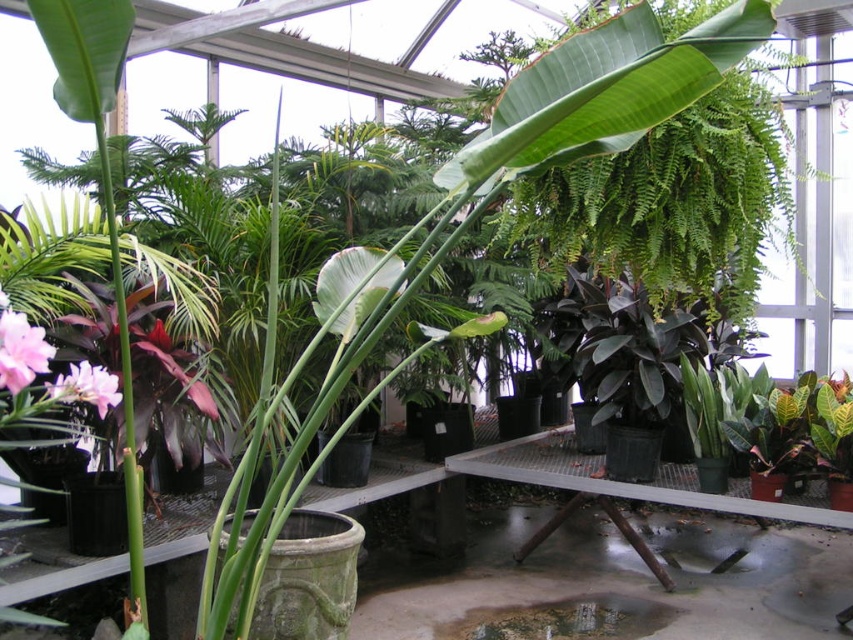
Question: Which point is closer to the camera taking this photo?

Choices:
 (A) (84, 385)
 (B) (20, 337)

Answer: (B)

Question: Can you confirm if pink matte flower at lower left is bigger than pink matte flower at center?

Choices:
 (A) yes
 (B) no

Answer: (B)

Question: Among these points, which one is nearest to the camera?

Choices:
 (A) (44, 349)
 (B) (61, 394)

Answer: (A)

Question: In this image, where is pink matte flower at lower left located relative to pink matte flower at center?

Choices:
 (A) left
 (B) right

Answer: (B)

Question: Which object appears farthest from the camera in this image?

Choices:
 (A) pink matte flower at lower left
 (B) pink matte flower at center

Answer: (B)

Question: Considering the relative positions of pink matte flower at lower left and pink matte flower at center in the image provided, where is pink matte flower at lower left located with respect to pink matte flower at center?

Choices:
 (A) left
 (B) right

Answer: (B)